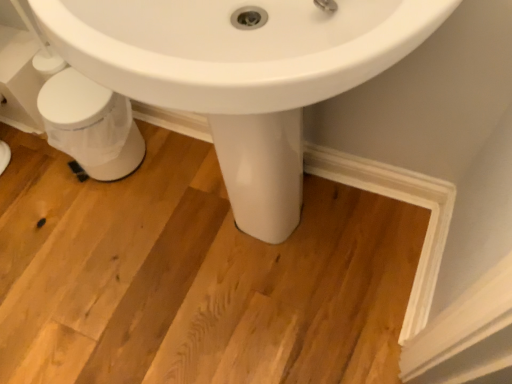
Identify the location of free space in front of white glossy sink at center. This screenshot has height=384, width=512. (270, 344).